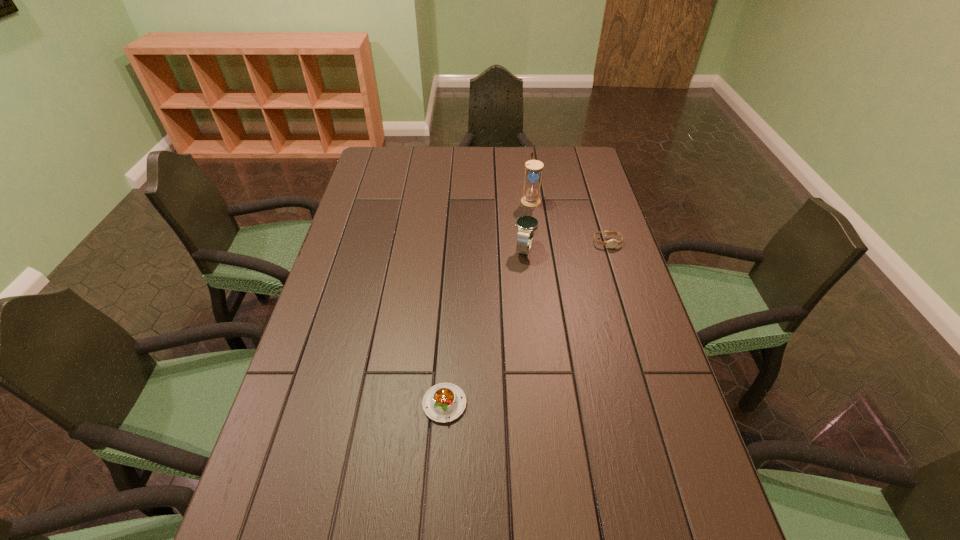
At what (x,y) coordinates should I click in order to perform the action: click on empty location between the tallest object and the nearest object. Please return your answer as a coordinate pair (x, y). This screenshot has height=540, width=960. Looking at the image, I should click on (488, 302).

Where is `free space between the farthest object and the pudding`? The image size is (960, 540). free space between the farthest object and the pudding is located at coordinates (488, 302).

Image resolution: width=960 pixels, height=540 pixels. Identify the location of blank region between the shorter watch and the tallest object. (569, 221).

What are the coordinates of `free space that is in between the right watch and the nearest object` in the screenshot? It's located at click(x=526, y=323).

This screenshot has width=960, height=540. What are the coordinates of `free area in between the farthest object and the shorter watch` in the screenshot? It's located at (569, 221).

Locate an element on the screen. The height and width of the screenshot is (540, 960). free space that is in between the nearest object and the tallest object is located at coordinates (488, 302).

Find the location of a particular element. The width and height of the screenshot is (960, 540). free space between the right watch and the left watch is located at coordinates (565, 246).

Find the location of a particular element. object identified as the third closest to the nearest object is located at coordinates (531, 198).

Locate which object ranks second in proximity to the rightmost object. Please provide its 2D coordinates. Your answer should be formatted as a tuple, i.e. [(x, y)], where the tuple contains the x and y coordinates of a point satisfying the conditions above.

[(531, 198)]

Where is `vacant space that satisfies the following two spatial constraints: 1. on the back side of the tallest object; 2. on the right side of the taller watch`? vacant space that satisfies the following two spatial constraints: 1. on the back side of the tallest object; 2. on the right side of the taller watch is located at coordinates [519, 200].